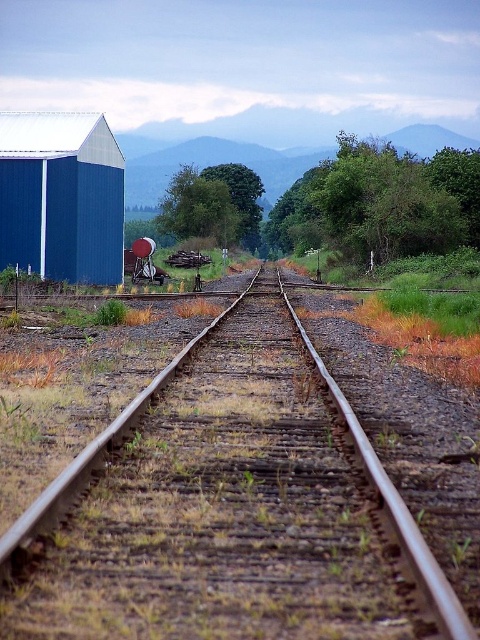
You are a photographer setting up a tripod to capture the rusty metal tracks at center and the blue matte barn at left. If you want to ensure both objects are clearly visible in your shot, which object should you focus on first considering their heights?

The rusty metal tracks at center has a lesser height compared to blue matte barn at left, so you should focus on the blue matte barn at left first to ensure both are in clear focus.

You are a photographer planning to take a wide shot of the blue matte barn at left and the rusty metal tracks at center. Based on their sizes in the image, which object would you need to position closer to the camera to ensure both appear equally large in the photo?

The rusty metal tracks at center occupies less space than blue matte barn at left, so you should position the rusty metal tracks at center closer to the camera to make them appear the same size as the blue matte barn at left in the photo.

You are standing at the vanishing point of the railway tracks and want to determine which of the two points, point (127, 579) or point (60, 157), is closer to you. Based on the scene description, which point is nearer?

Point (127, 579) is closer to the viewer than point (60, 157).